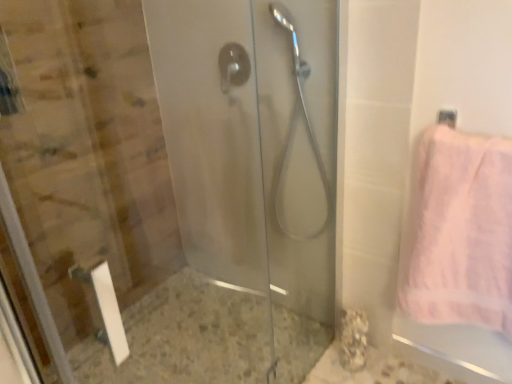
Question: Is satin silver shower handle at center, which ranks as the first shower in left-to-right order, located within pink fluffy towel at right?

Choices:
 (A) yes
 (B) no

Answer: (B)

Question: Does pink fluffy towel at right turn towards satin silver shower handle at center, which ranks as the first shower in left-to-right order?

Choices:
 (A) yes
 (B) no

Answer: (B)

Question: Considering the relative sizes of pink fluffy towel at right and satin silver shower handle at center, placed as the second shower when sorted from right to left, in the image provided, is pink fluffy towel at right shorter than satin silver shower handle at center, placed as the second shower when sorted from right to left,?

Choices:
 (A) yes
 (B) no

Answer: (B)

Question: Does pink fluffy towel at right have a greater height compared to satin silver shower handle at center, placed as the second shower when sorted from right to left?

Choices:
 (A) yes
 (B) no

Answer: (A)

Question: Does pink fluffy towel at right have a lesser width compared to satin silver shower handle at center, which ranks as the first shower in left-to-right order?

Choices:
 (A) no
 (B) yes

Answer: (A)

Question: In terms of width, does pink fluffy towel at right look wider or thinner when compared to satin silver shower handle at center, placed as the second shower when sorted from right to left?

Choices:
 (A) thin
 (B) wide

Answer: (B)

Question: Relative to satin silver shower handle at center, placed as the second shower when sorted from right to left, is pink fluffy towel at right in front or behind?

Choices:
 (A) behind
 (B) front

Answer: (B)

Question: Considering the relative positions of pink fluffy towel at right and satin silver shower handle at center, which ranks as the first shower in left-to-right order, in the image provided, is pink fluffy towel at right to the left or to the right of satin silver shower handle at center, which ranks as the first shower in left-to-right order,?

Choices:
 (A) left
 (B) right

Answer: (B)

Question: Considering the positions of pink fluffy towel at right and satin silver shower handle at center, placed as the second shower when sorted from right to left, in the image, is pink fluffy towel at right taller or shorter than satin silver shower handle at center, placed as the second shower when sorted from right to left,?

Choices:
 (A) tall
 (B) short

Answer: (A)

Question: From a real-world perspective, relative to satin nickel shower head at center, the 1th shower positioned from the right, is satin silver shower handle at center, placed as the second shower when sorted from right to left, vertically above or below?

Choices:
 (A) below
 (B) above

Answer: (B)

Question: From their relative heights in the image, would you say satin silver shower handle at center, placed as the second shower when sorted from right to left, is taller or shorter than satin nickel shower head at center, the second shower when ordered from left to right?

Choices:
 (A) tall
 (B) short

Answer: (B)

Question: Does point (228, 43) appear closer or farther from the camera than point (309, 122)?

Choices:
 (A) closer
 (B) farther

Answer: (B)

Question: From the image's perspective, is satin silver shower handle at center, placed as the second shower when sorted from right to left, located above or below satin nickel shower head at center, the second shower when ordered from left to right?

Choices:
 (A) above
 (B) below

Answer: (A)

Question: Is satin nickel shower head at center, the 1th shower positioned from the right, to the left or to the right of transparent glass shower door at left in the image?

Choices:
 (A) left
 (B) right

Answer: (B)

Question: Considering the positions of point (x=309, y=233) and point (x=181, y=329), is point (x=309, y=233) closer or farther from the camera than point (x=181, y=329)?

Choices:
 (A) farther
 (B) closer

Answer: (B)